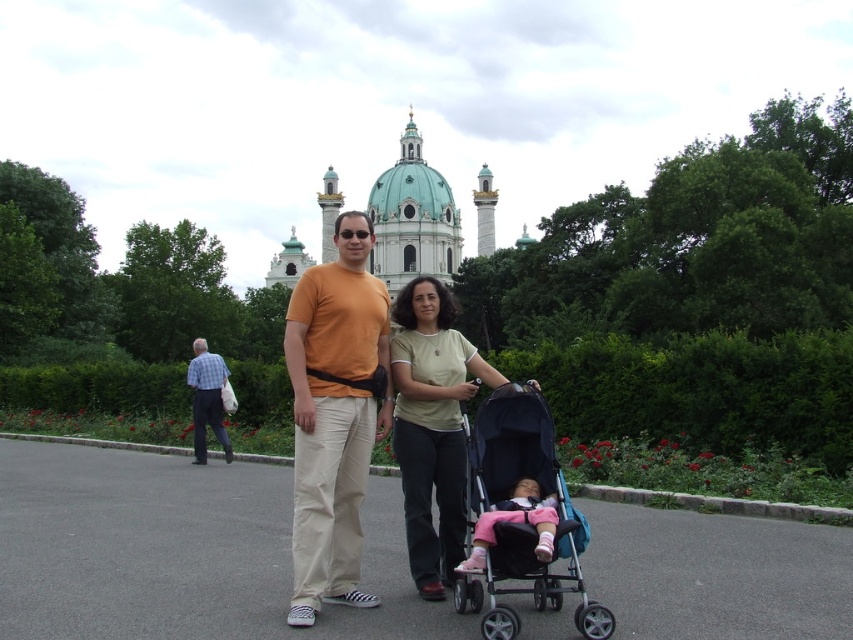
You are a photographer trying to capture a photo that includes both the white marble palace at center and the pink fabric baby carriage at center. Based on their positions, which one should you focus on first to ensure both are in frame?

The white marble palace at center is located above the pink fabric baby carriage at center, so you should focus on the pink fabric baby carriage at center first to ensure both are in frame.

You are a photographer standing at the camera position. You want to capture a closeup shot of the light green cotton shirt at center. Given that your camera can focus on objects within 50 feet, will you be able to take the closeup shot?

The light green cotton shirt at center is 308.02 feet away from the camera, which is much farther than the 50 feet focus range. Therefore, you cannot take a closeup shot with the current camera settings.